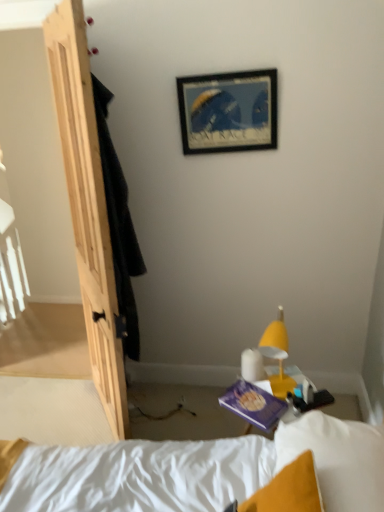
Question: Relative to wooden picture frame at upper center, is yellow matte lamp at lower right in front or behind?

Choices:
 (A) behind
 (B) front

Answer: (B)

Question: From their relative heights in the image, would you say yellow matte lamp at lower right is taller or shorter than wooden picture frame at upper center?

Choices:
 (A) short
 (B) tall

Answer: (B)

Question: Which of these objects is positioned farthest from the natural wood door at left?

Choices:
 (A) yellow matte lamp at lower right
 (B) wooden picture frame at upper center
 (C) purple matte paperback book at lower center

Answer: (A)

Question: Considering the real-world distances, which object is closest to the purple matte paperback book at lower center?

Choices:
 (A) wooden picture frame at upper center
 (B) yellow matte lamp at lower right
 (C) natural wood door at left

Answer: (B)